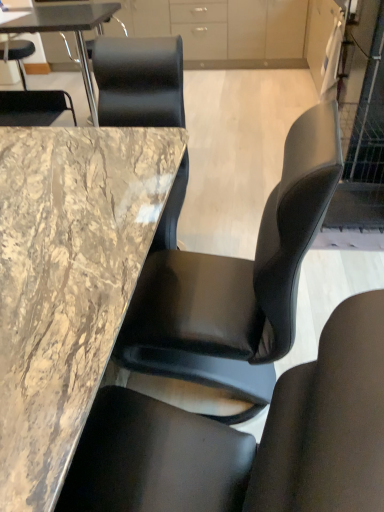
Question: Are black leather chair at center, the second chair positioned from the back, and marble table at center, the first table from the front, far apart?

Choices:
 (A) yes
 (B) no

Answer: (B)

Question: From a real-world perspective, is black leather chair at center, placed as the 2th chair when sorted from top to bottom, under marble table at center, the second table viewed from the top?

Choices:
 (A) no
 (B) yes

Answer: (A)

Question: Can you see black leather chair at center, positioned as the 1th chair in bottom-to-top order, touching marble table at center, which is the second table from back to front?

Choices:
 (A) no
 (B) yes

Answer: (A)

Question: Does black leather chair at center, positioned as the 1th chair in bottom-to-top order, lie behind marble table at center, which appears as the first table when ordered from the bottom?

Choices:
 (A) yes
 (B) no

Answer: (B)

Question: Is black leather chair at center, acting as the 1th chair starting from the right, to the right of marble table at center, the first table from the front, from the viewer's perspective?

Choices:
 (A) yes
 (B) no

Answer: (A)

Question: From the image's perspective, relative to marble table at center, which is the second table from back to front, is matte white cabinet at upper right, which is counted as the 1th cabinetry, starting from the front, above or below?

Choices:
 (A) above
 (B) below

Answer: (A)

Question: Would you say matte white cabinet at upper right, arranged as the first cabinetry when viewed from the right, is to the left or to the right of marble table at center, the second table viewed from the top, in the picture?

Choices:
 (A) left
 (B) right

Answer: (B)

Question: In the image, is matte white cabinet at upper right, arranged as the first cabinetry when viewed from the right, positioned in front of or behind marble table at center, the second table viewed from the top?

Choices:
 (A) front
 (B) behind

Answer: (B)

Question: Does point (329, 5) appear closer or farther from the camera than point (137, 156)?

Choices:
 (A) farther
 (B) closer

Answer: (A)

Question: From their relative heights in the image, would you say black leather chair at center, acting as the 1th chair starting from the right, is taller or shorter than marble/black at upper left, which is counted as the 2th table, starting from the front?

Choices:
 (A) short
 (B) tall

Answer: (B)

Question: Choose the correct answer: Is black leather chair at center, placed as the 2th chair when sorted from top to bottom, inside marble/black at upper left, the 1th table from the back, or outside it?

Choices:
 (A) inside
 (B) outside

Answer: (B)

Question: From the image's perspective, is black leather chair at center, positioned as the 1th chair in bottom-to-top order, located above or below marble/black at upper left, the first table from the top?

Choices:
 (A) above
 (B) below

Answer: (B)

Question: Would you say black leather chair at center, placed as the 2th chair when sorted from top to bottom, is to the left or to the right of marble/black at upper left, which is counted as the 2th table, starting from the front, in the picture?

Choices:
 (A) right
 (B) left

Answer: (A)

Question: Looking at their shapes, would you say matte white cabinet at upper right, marked as the 2th cabinetry in a back-to-front arrangement, is wider or thinner than matte white cabinet at upper center, which appears as the second cabinetry when viewed from the right?

Choices:
 (A) wide
 (B) thin

Answer: (B)

Question: In terms of size, does matte white cabinet at upper right, the second cabinetry viewed from the top, appear bigger or smaller than matte white cabinet at upper center, the 1th cabinetry in the top-to-bottom sequence?

Choices:
 (A) big
 (B) small

Answer: (B)